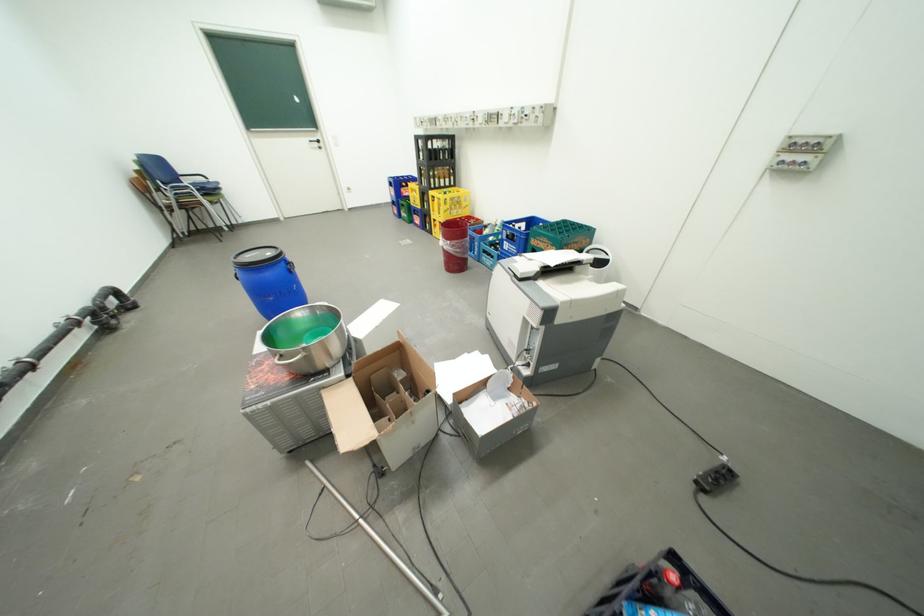
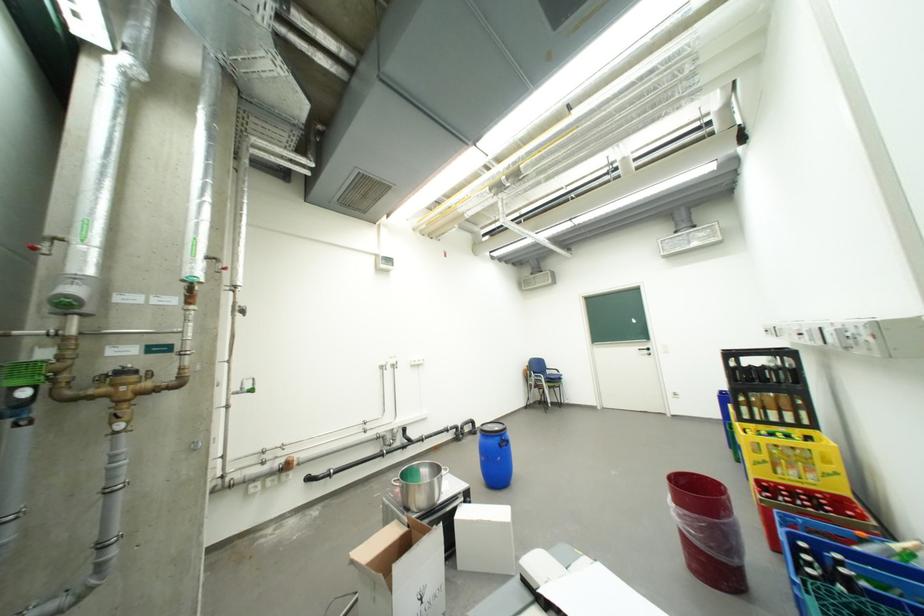
Locate, in the second image, the point that corresponds to pixel 468 217 in the first image.

(810, 484)